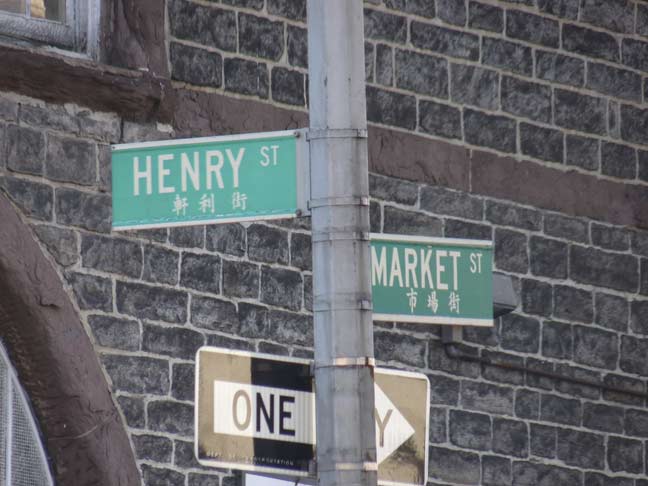
Find the location of `light in room`. light in room is located at coordinates tap(38, 11).